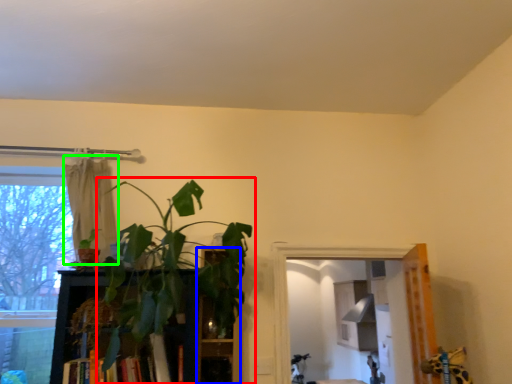
Question: Estimate the real-world distances between objects in this image. Which object is farther from houseplant (highlighted by a red box), shelf (highlighted by a blue box) or curtain (highlighted by a green box)?

Choices:
 (A) shelf
 (B) curtain

Answer: (B)